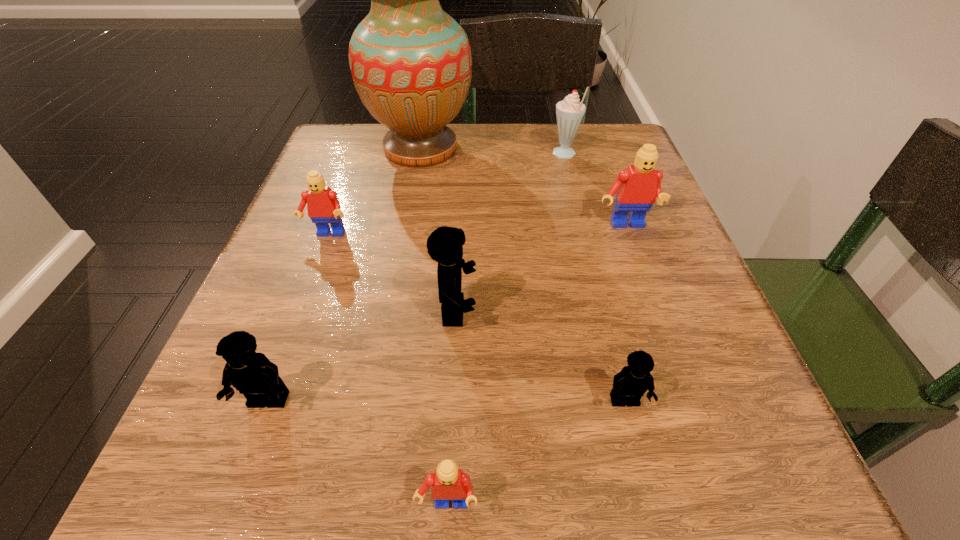
Image resolution: width=960 pixels, height=540 pixels. I want to click on vacant region at the far left corner of the desktop, so click(x=339, y=141).

Find the location of a particular element. vacant region at the far right corner is located at coordinates (573, 148).

At what (x,y) coordinates should I click in order to perform the action: click on blank region between the tallest object and the milkshake. Please return your answer as a coordinate pair (x, y). The image size is (960, 540). Looking at the image, I should click on (492, 152).

Find the location of `free spot between the milkshake and the leftmost yellow Lego`. free spot between the milkshake and the leftmost yellow Lego is located at coordinates (417, 278).

Where is `free space between the leftmost red Lego and the nearest red Lego`? This screenshot has height=540, width=960. free space between the leftmost red Lego and the nearest red Lego is located at coordinates (387, 371).

Locate an element on the screen. empty location between the second smallest yellow Lego and the smallest yellow Lego is located at coordinates (446, 401).

The width and height of the screenshot is (960, 540). I want to click on free area in between the second smallest yellow Lego and the leftmost red Lego, so click(298, 318).

I want to click on vacant area that lies between the rightmost yellow Lego and the biggest yellow Lego, so click(540, 356).

The image size is (960, 540). What are the coordinates of `vacant space in between the second smallest red Lego and the smallest yellow Lego` in the screenshot? It's located at (476, 319).

Find the location of `free space between the tallest object and the nearest red Lego`. free space between the tallest object and the nearest red Lego is located at coordinates (434, 327).